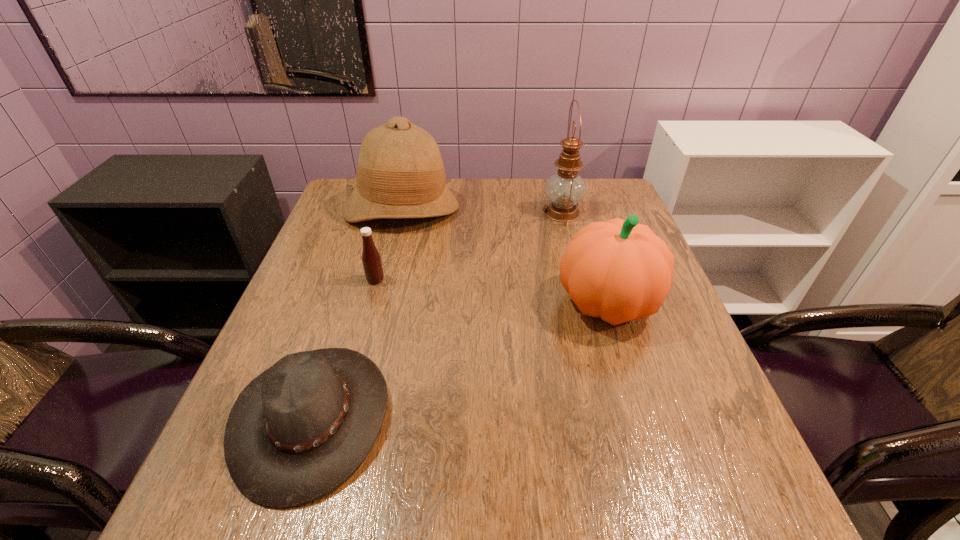
Find the location of a particular element. vacant space situated on the front-facing side of the shortest object is located at coordinates (567, 417).

Locate an element on the screen. The image size is (960, 540). oil lamp that is positioned at the far edge is located at coordinates (565, 189).

At what (x,y) coordinates should I click in order to perform the action: click on hat located at the far edge. Please return your answer as a coordinate pair (x, y). The width and height of the screenshot is (960, 540). Looking at the image, I should click on (400, 174).

Find the location of a particular element. The height and width of the screenshot is (540, 960). object at the near edge is located at coordinates (295, 433).

Where is `oil lamp positioned at the right edge`? oil lamp positioned at the right edge is located at coordinates (565, 189).

The image size is (960, 540). I want to click on pumpkin that is at the right edge, so click(618, 270).

Where is `object located in the far left corner section of the desktop`? Image resolution: width=960 pixels, height=540 pixels. object located in the far left corner section of the desktop is located at coordinates (400, 174).

Locate an element on the screen. This screenshot has height=540, width=960. object at the near left corner is located at coordinates (295, 433).

Where is `object that is at the far right corner`? object that is at the far right corner is located at coordinates (565, 189).

Where is `vacant area at the far edge`? The width and height of the screenshot is (960, 540). vacant area at the far edge is located at coordinates (478, 179).